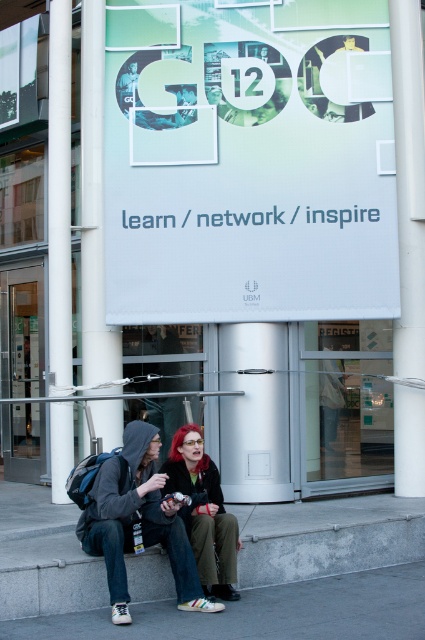
Question: Is white smooth pillar at left below shiny red hair at center?

Choices:
 (A) no
 (B) yes

Answer: (A)

Question: Does matte black hoodie at lower left have a smaller size compared to shiny red hair at center?

Choices:
 (A) no
 (B) yes

Answer: (A)

Question: Which of the following is the closest to the observer?

Choices:
 (A) gray concrete stairs at lower center
 (B) shiny red hair at center

Answer: (B)

Question: Which object appears closest to the camera in this image?

Choices:
 (A) matte black hoodie at lower left
 (B) shiny red hair at center
 (C) gray concrete stairs at lower center

Answer: (A)

Question: Is matte black hoodie at lower left above shiny red hair at center?

Choices:
 (A) yes
 (B) no

Answer: (B)

Question: Which object is positioned farthest from the gray concrete stairs at lower center?

Choices:
 (A) matte black hoodie at lower left
 (B) white smooth pillar at left
 (C) shiny red hair at center

Answer: (B)